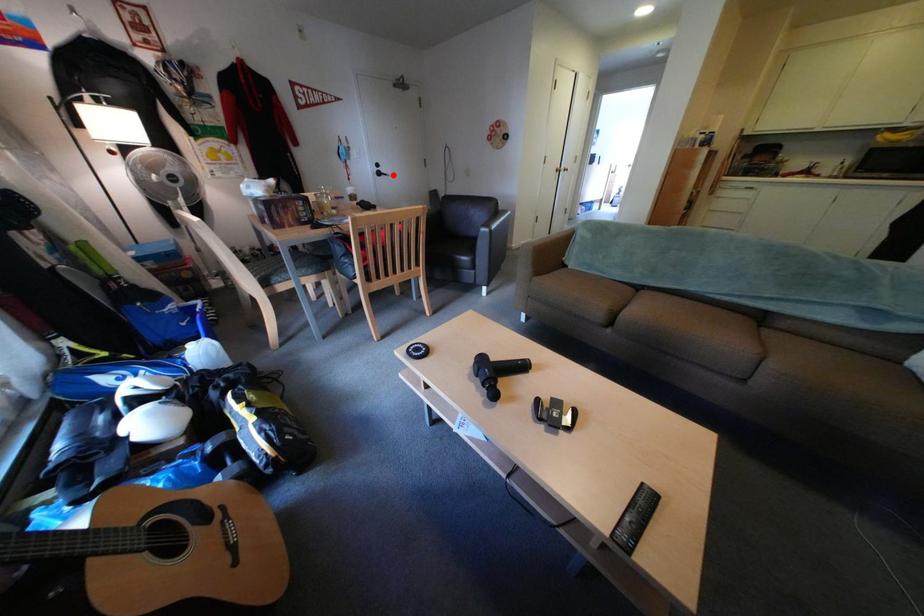
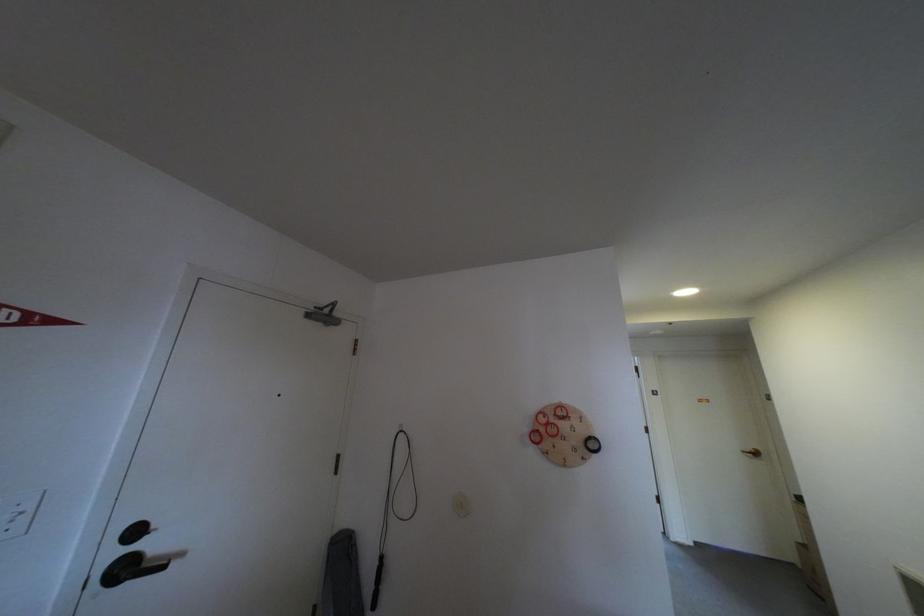
In the second image, find the point that corresponds to the highlighted location in the first image.

(140, 570)